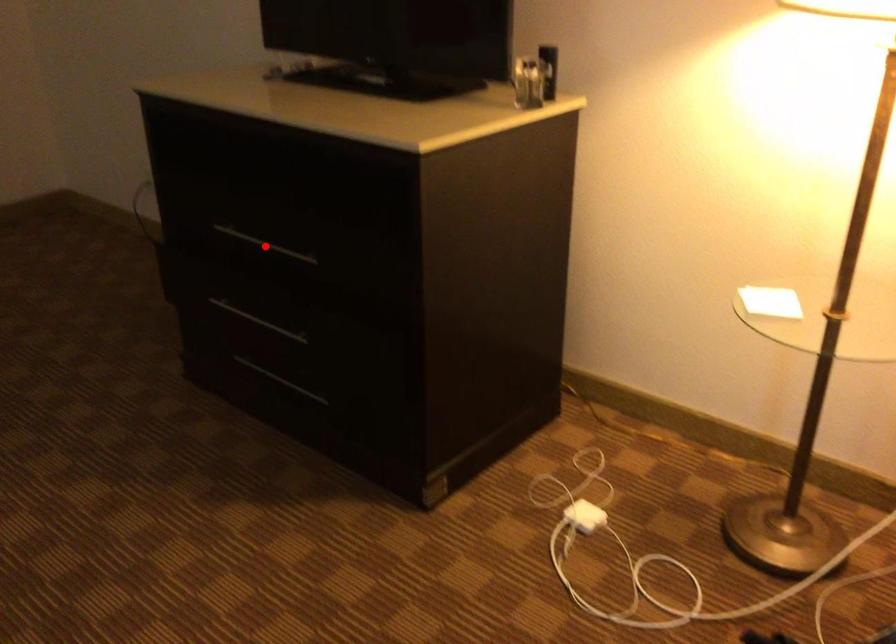
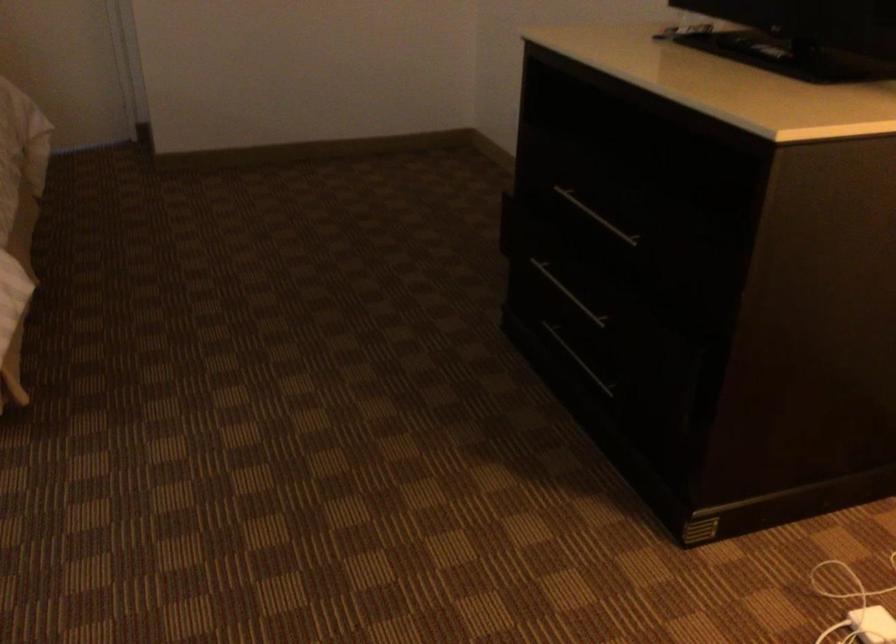
In the second image, find the point that corresponds to the highlighted location in the first image.

(596, 216)